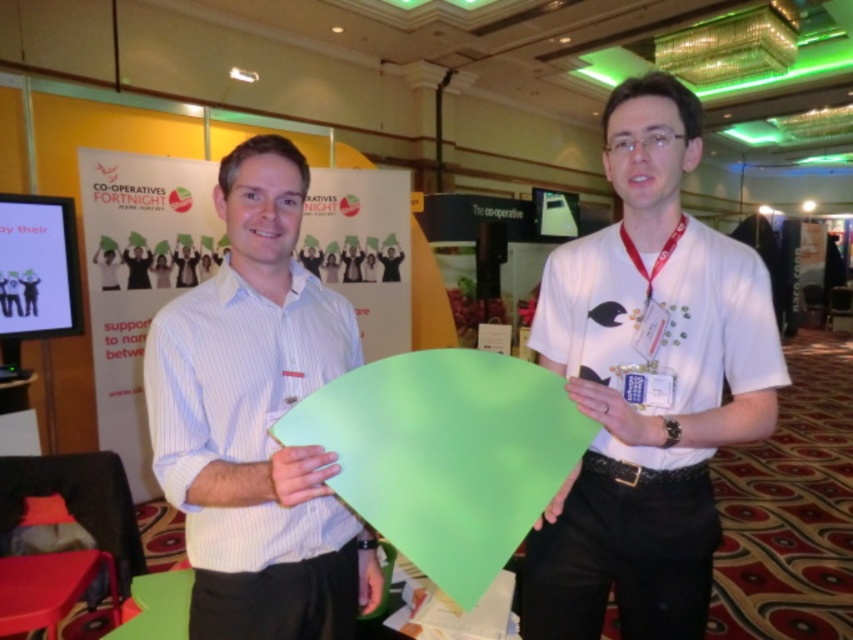
Question: Is white striped shirt at center to the left of white matte neck at center from the viewer's perspective?

Choices:
 (A) no
 (B) yes

Answer: (A)

Question: Does white fabric at center lie in front of white matte neck at center?

Choices:
 (A) yes
 (B) no

Answer: (B)

Question: Which is farther from the white matte t-shirt at center?

Choices:
 (A) white fabric at center
 (B) white striped shirt at center
 (C) white matte neck at center

Answer: (C)

Question: Considering the relative positions of white striped shirt at center and white fabric at center in the image provided, where is white striped shirt at center located with respect to white fabric at center?

Choices:
 (A) right
 (B) left

Answer: (B)

Question: Which object appears farthest from the camera in this image?

Choices:
 (A) white striped shirt at center
 (B) white matte t-shirt at center
 (C) white matte neck at center
 (D) white fabric at center

Answer: (D)

Question: Among these points, which one is farthest from the camera?

Choices:
 (A) click(622, 154)
 (B) click(263, 483)

Answer: (A)